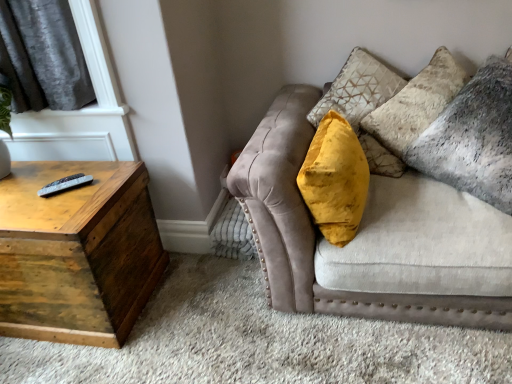
Locate an element on the screen. free space in front of black plastic remote at left is located at coordinates [x=60, y=213].